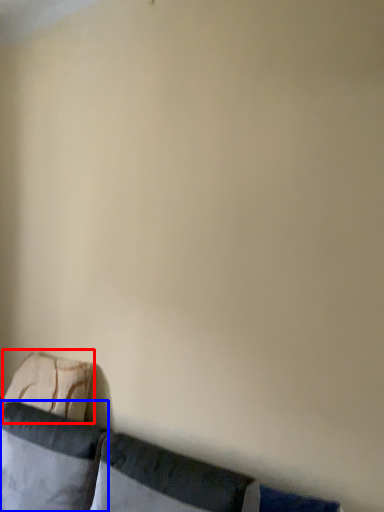
Question: Which of the following is the farthest to the observer, pillow (highlighted by a red box) or pillow (highlighted by a blue box)?

Choices:
 (A) pillow
 (B) pillow

Answer: (A)